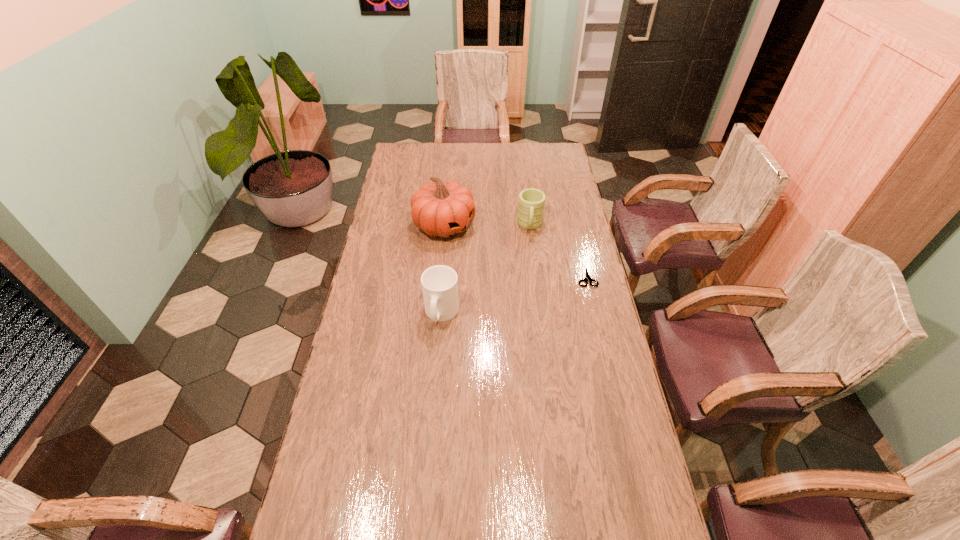
The width and height of the screenshot is (960, 540). Find the location of `the nearest object`. the nearest object is located at coordinates 439,283.

Locate an element on the screen. Image resolution: width=960 pixels, height=540 pixels. the left mug is located at coordinates (439, 283).

This screenshot has width=960, height=540. I want to click on shears, so click(587, 277).

Find the location of a particular element. This screenshot has width=960, height=540. the rightmost object is located at coordinates (587, 277).

Identify the location of the second object from right to left. The width and height of the screenshot is (960, 540). (531, 203).

In order to click on the right mug in this screenshot , I will do `click(531, 203)`.

This screenshot has width=960, height=540. I want to click on the tallest object, so click(443, 209).

You are a GUI agent. You are given a task and a screenshot of the screen. Output one action in this format:
    pyautogui.click(x=<x>, y=<y>)
    Task: Click on the free region located on the handle side of the nearest object
    This screenshot has height=540, width=960.
    Given the screenshot: What is the action you would take?
    point(434,411)

The width and height of the screenshot is (960, 540). I want to click on vacant space located 0.280m on the front of the shears, so click(x=604, y=349).

Image resolution: width=960 pixels, height=540 pixels. In order to click on free space located 0.200m on the side of the right mug with the handle in this screenshot , I will do `click(530, 271)`.